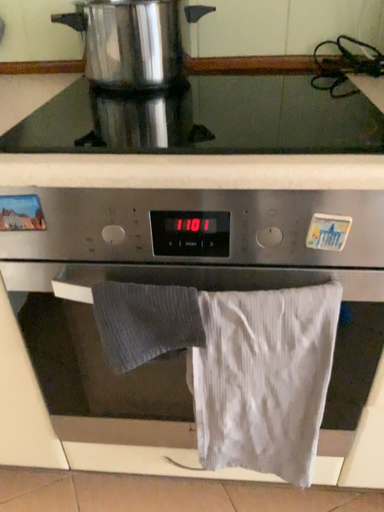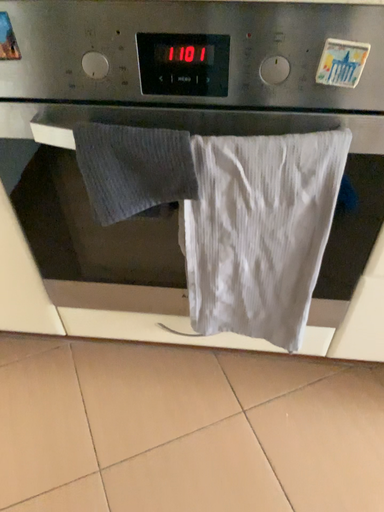
Question: Which way did the camera rotate in the video?

Choices:
 (A) rotated upward
 (B) rotated downward

Answer: (B)